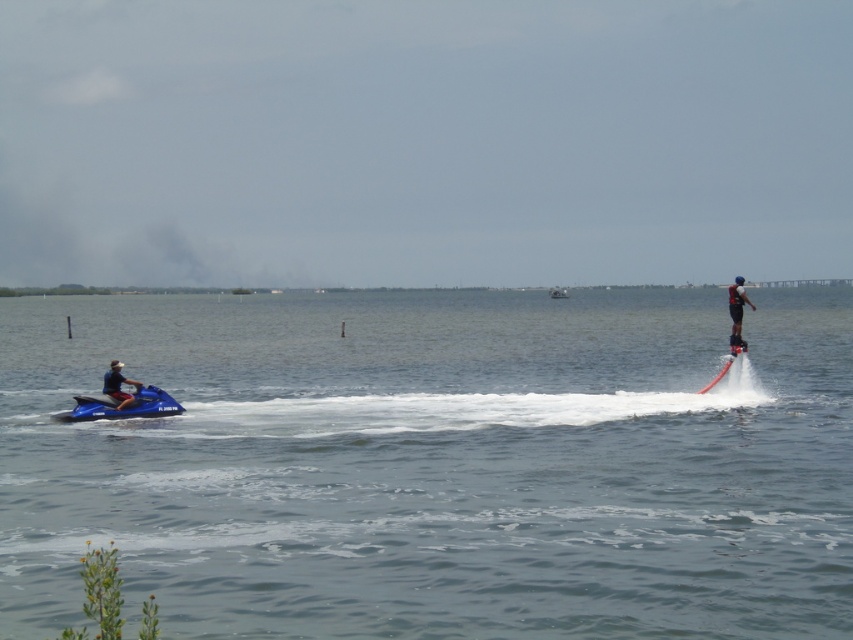
Question: Can you confirm if blue matte jet ski at left is positioned to the right of red matte water ski at right?

Choices:
 (A) no
 (B) yes

Answer: (A)

Question: Which point is farther to the camera?

Choices:
 (A) matte black jet ski at left
 (B) clear water at jet ski left
 (C) black matte water skier at right
 (D) blue matte jet ski at left

Answer: (A)

Question: Which point is closer to the camera?

Choices:
 (A) (554, 296)
 (B) (126, 404)

Answer: (B)

Question: Is clear water at jet ski left positioned at the back of matte black jet ski at left?

Choices:
 (A) no
 (B) yes

Answer: (A)

Question: Is blue matte jet ski at left wider than matte black jet ski at left?

Choices:
 (A) yes
 (B) no

Answer: (A)

Question: Based on their relative distances, which object is nearer to the blue matte jet ski at left?

Choices:
 (A) matte black jet ski at left
 (B) black matte water skier at right
 (C) red matte water ski at right
 (D) white plastic boat at center

Answer: (A)